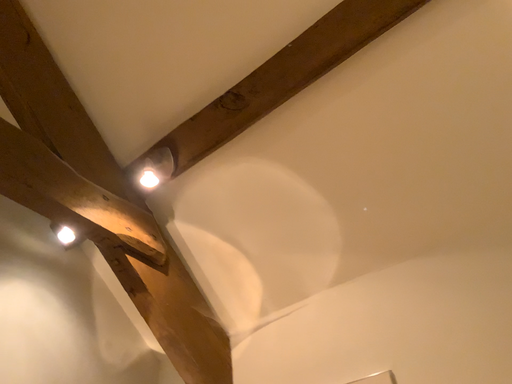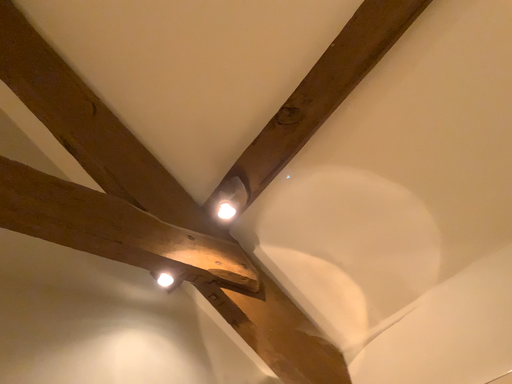
Question: Which way did the camera rotate in the video?

Choices:
 (A) rotated right
 (B) rotated left

Answer: (B)